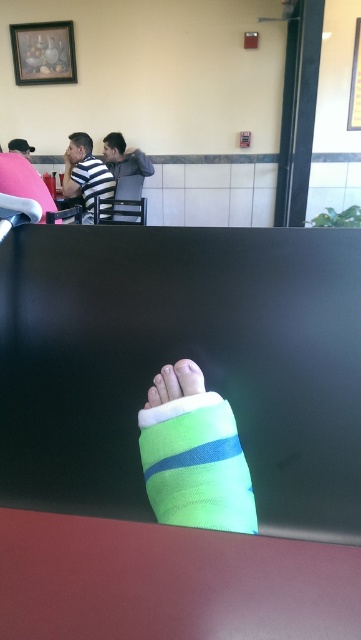
You are a delivery person who needs to place a small package on the table between the green fabric sock at lower center and the striped shirt man at the table. The package is 10 inches long. Can you fit it diagonally between them without moving any objects?

The distance between the green fabric sock at lower center and the striped shirt man at the table is 21.68 inches. Since the package is only 10 inches long, placing it diagonally would easily fit within the available space.

You are a customer in a fast food restaurant. You see a green fabric sock at lower center and a striped cotton shirt at upper left. Which object is closer to you?

The green fabric sock at lower center is closer to you because it is in front of the striped cotton shirt at upper left.